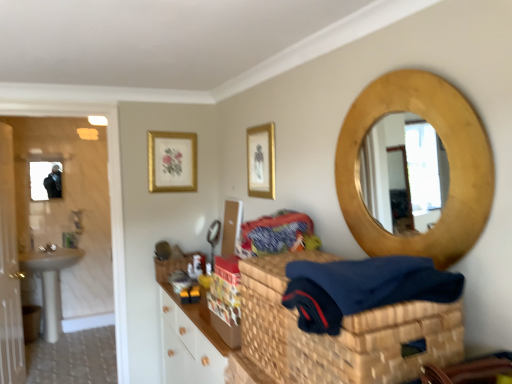
Question: Is woven straw basket at center at the left side of patterned fabric at center?

Choices:
 (A) no
 (B) yes

Answer: (A)

Question: Could patterned fabric at center be considered to be inside woven straw basket at center?

Choices:
 (A) yes
 (B) no

Answer: (B)

Question: Is woven straw basket at center not within patterned fabric at center?

Choices:
 (A) no
 (B) yes

Answer: (B)

Question: Considering the relative sizes of woven straw basket at center and patterned fabric at center in the image provided, is woven straw basket at center taller than patterned fabric at center?

Choices:
 (A) yes
 (B) no

Answer: (A)

Question: Is woven straw basket at center positioned with its back to patterned fabric at center?

Choices:
 (A) no
 (B) yes

Answer: (A)

Question: Considering the positions of white glossy door at left and gold metallic picture frame at upper center, the 1th picture frame in the right-to-left sequence, in the image, is white glossy door at left bigger or smaller than gold metallic picture frame at upper center, the 1th picture frame in the right-to-left sequence,?

Choices:
 (A) big
 (B) small

Answer: (A)

Question: In terms of height, does white glossy door at left look taller or shorter compared to gold metallic picture frame at upper center, acting as the 2th picture frame starting from the left?

Choices:
 (A) tall
 (B) short

Answer: (A)

Question: Considering the positions of white glossy door at left and gold metallic picture frame at upper center, the 1th picture frame when ordered from front to back, in the image, is white glossy door at left wider or thinner than gold metallic picture frame at upper center, the 1th picture frame when ordered from front to back,?

Choices:
 (A) thin
 (B) wide

Answer: (B)

Question: Considering the positions of point (19, 326) and point (266, 188), is point (19, 326) closer or farther from the camera than point (266, 188)?

Choices:
 (A) farther
 (B) closer

Answer: (A)

Question: Is point (38, 192) positioned closer to the camera than point (165, 155)?

Choices:
 (A) farther
 (B) closer

Answer: (A)

Question: Relative to gold-framed artwork at upper center, the 1th picture frame when ordered from left to right, is gold textured mirror at upper right in front or behind?

Choices:
 (A) behind
 (B) front

Answer: (A)

Question: From the image's perspective, is gold textured mirror at upper right positioned above or below gold-framed artwork at upper center, the first picture frame in the back-to-front sequence?

Choices:
 (A) above
 (B) below

Answer: (B)

Question: Considering the positions of gold textured mirror at upper right and gold-framed artwork at upper center, the 1th picture frame when ordered from left to right, in the image, is gold textured mirror at upper right wider or thinner than gold-framed artwork at upper center, the 1th picture frame when ordered from left to right,?

Choices:
 (A) thin
 (B) wide

Answer: (B)

Question: In terms of width, does white glossy door at left look wider or thinner when compared to patterned fabric at center?

Choices:
 (A) thin
 (B) wide

Answer: (A)

Question: From a real-world perspective, is white glossy door at left positioned above or below patterned fabric at center?

Choices:
 (A) below
 (B) above

Answer: (A)